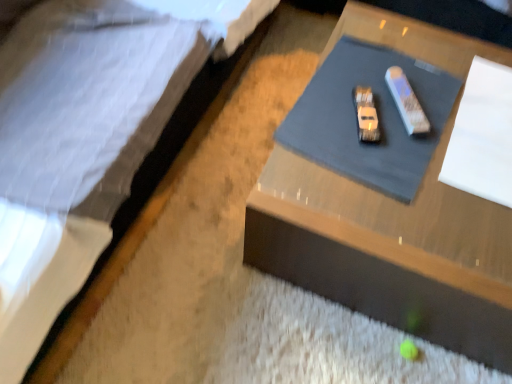
Question: Is white paper at upper right closer to the viewer compared to white quilted fabric at upper left?

Choices:
 (A) yes
 (B) no

Answer: (B)

Question: Is white paper at upper right beside white quilted fabric at upper left?

Choices:
 (A) no
 (B) yes

Answer: (A)

Question: Can we say white paper at upper right lies outside white quilted fabric at upper left?

Choices:
 (A) yes
 (B) no

Answer: (A)

Question: Can you confirm if white paper at upper right is positioned to the left of white quilted fabric at upper left?

Choices:
 (A) no
 (B) yes

Answer: (A)

Question: From the image's perspective, is white paper at upper right located above white quilted fabric at upper left?

Choices:
 (A) yes
 (B) no

Answer: (B)

Question: From a real-world perspective, does white paper at upper right sit lower than white quilted fabric at upper left?

Choices:
 (A) yes
 (B) no

Answer: (A)

Question: From the image's perspective, does white paper at upper right appear higher than wooden table at center?

Choices:
 (A) no
 (B) yes

Answer: (B)

Question: Does white paper at upper right lie behind wooden table at center?

Choices:
 (A) no
 (B) yes

Answer: (B)

Question: Does white paper at upper right have a greater height compared to wooden table at center?

Choices:
 (A) yes
 (B) no

Answer: (B)

Question: From a real-world perspective, is white paper at upper right on wooden table at center?

Choices:
 (A) no
 (B) yes

Answer: (B)

Question: Is white paper at upper right shorter than wooden table at center?

Choices:
 (A) no
 (B) yes

Answer: (B)

Question: Can wooden table at center be found inside white paper at upper right?

Choices:
 (A) no
 (B) yes

Answer: (A)

Question: Can we say wooden table at center lies outside white quilted fabric at upper left?

Choices:
 (A) no
 (B) yes

Answer: (B)